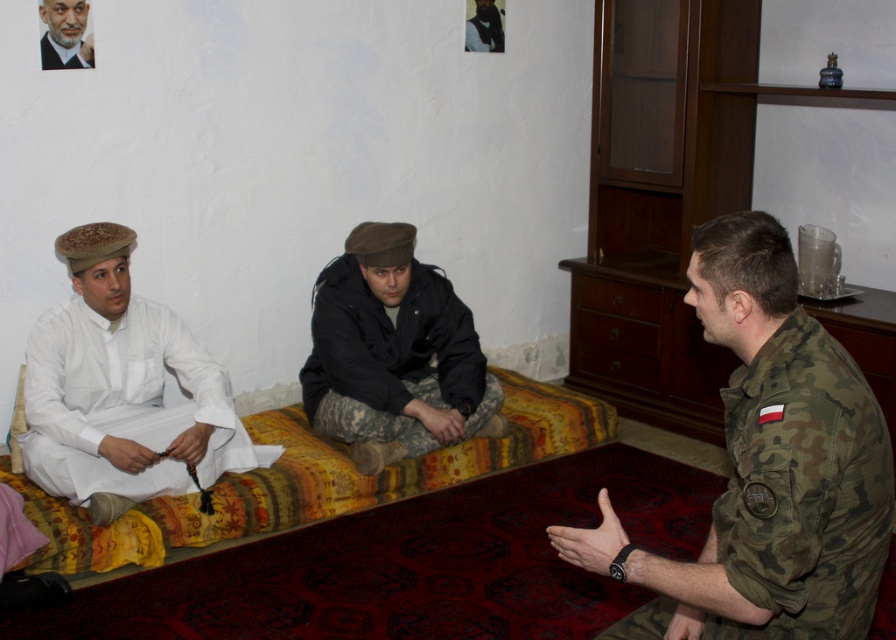
Question: Which of the following is the closest to the observer?

Choices:
 (A) (826, 342)
 (B) (467, 312)
 (C) (498, 452)

Answer: (A)

Question: Which point is farther to the camera?

Choices:
 (A) white cotton shirt at left
 (B) camouflage pants at center
 (C) smooth white robe at left

Answer: (B)

Question: Can you confirm if smooth white robe at left is bigger than dark brown leather jacket at upper center?

Choices:
 (A) no
 (B) yes

Answer: (A)

Question: Can you confirm if white cotton shirt at left is wider than dark brown leather jacket at upper center?

Choices:
 (A) no
 (B) yes

Answer: (B)

Question: Among these objects, which one is nearest to the camera?

Choices:
 (A) carpeted couch at center
 (B) camouflage pants at center
 (C) white cotton shirt at left
 (D) smooth white robe at left

Answer: (A)

Question: Is white cotton shirt at left smaller than dark brown leather jacket at upper center?

Choices:
 (A) yes
 (B) no

Answer: (B)